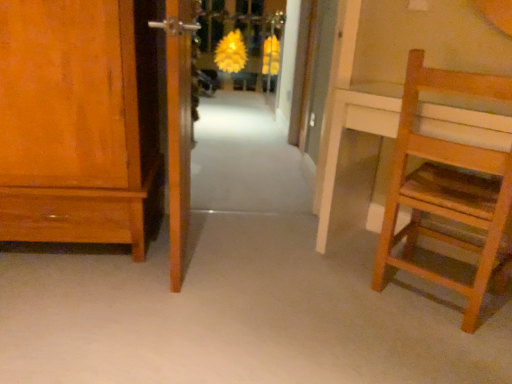
The height and width of the screenshot is (384, 512). I want to click on light brown wooden chair at right, so click(448, 188).

This screenshot has width=512, height=384. Describe the element at coordinates (318, 76) in the screenshot. I see `wooden door at center, positioned as the second door in front-to-back order` at that location.

Describe the element at coordinates (179, 124) in the screenshot. I see `wooden door at left, which ranks as the second door in back-to-front order` at that location.

Image resolution: width=512 pixels, height=384 pixels. What do you see at coordinates (239, 315) in the screenshot?
I see `wooden floor at center` at bounding box center [239, 315].

The height and width of the screenshot is (384, 512). Identify the location of yellow matte flower at center. (231, 52).

Does point (315, 124) lie in front of point (413, 128)?

No, it is behind (413, 128).

Is wooden door at center, positioned as the second door in front-to-back order, not close to light brown wooden chair at right?

Yes.

Choose the correct answer: Is wooden door at center, which ranks as the second door in left-to-right order, inside light brown wooden chair at right or outside it?

The correct answer is: outside.

At what (x,y) coordinates should I click in order to perform the action: click on chair below the wooden door at center, acting as the first door starting from the back (from the image's perspective). Please return your answer as a coordinate pair (x, y). Looking at the image, I should click on (448, 188).

Find the location of a particular element. This screenshot has height=384, width=512. plain located in front of the wooden door at left, which is the 2th door in right-to-left order is located at coordinates (239, 315).

Looking at their sizes, would you say wooden floor at center is wider or thinner than wooden door at left, acting as the first door starting from the front?

Considering their sizes, wooden floor at center looks broader than wooden door at left, acting as the first door starting from the front.

From the image's perspective, is wooden floor at center positioned above or below wooden door at left, which appears as the 1th door when viewed from the left?

Clearly, from the image's perspective, wooden floor at center is below wooden door at left, which appears as the 1th door when viewed from the left.

Would you say matte wood cabinet at left is outside wooden floor at center?

Yes, matte wood cabinet at left is located beyond the bounds of wooden floor at center.

From the image's perspective, between matte wood cabinet at left and wooden floor at center, which one is located above?

matte wood cabinet at left.

From a real-world perspective, between matte wood cabinet at left and wooden floor at center, who is vertically lower?

wooden floor at center is physically lower.

Does point (108, 224) appear closer or farther from the camera than point (414, 383)?

Point (108, 224) is positioned farther from the camera compared to point (414, 383).

Identify the location of plain located underneath the wooden door at center, positioned as the second door in front-to-back order (from a real-world perspective). (239, 315).

Who is bigger, wooden floor at center or wooden door at center, which ranks as the second door in left-to-right order?

wooden floor at center.

Does wooden floor at center touch wooden door at center, acting as the first door starting from the back?

No, wooden floor at center is not next to wooden door at center, acting as the first door starting from the back.

Is wooden floor at center taller or shorter than wooden door at center, which ranks as the second door in left-to-right order?

In the image, wooden floor at center appears to be shorter than wooden door at center, which ranks as the second door in left-to-right order.

From the picture: Considering the relative sizes of wooden floor at center and white carpet at center in the image provided, is wooden floor at center bigger than white carpet at center?

No, wooden floor at center is not bigger than white carpet at center.

Is wooden floor at center in front of or behind white carpet at center in the image?

Visually, wooden floor at center is located in front of white carpet at center.

Can you confirm if wooden floor at center is taller than white carpet at center?

In fact, wooden floor at center may be shorter than white carpet at center.

Is wooden floor at center facing towards white carpet at center?

Yes, wooden floor at center faces towards white carpet at center.

Between wooden floor at center and matte wood cabinet at left, which one appears on the left side from the viewer's perspective?

matte wood cabinet at left is more to the left.

Is there a large distance between wooden floor at center and matte wood cabinet at left?

That's not correct — wooden floor at center is a little close to matte wood cabinet at left.

In the scene shown: From a real-world perspective, is wooden floor at center on top of matte wood cabinet at left?

No, from a real-world perspective, wooden floor at center is not over matte wood cabinet at left

Is wooden floor at center located outside matte wood cabinet at left?

wooden floor at center is positioned outside matte wood cabinet at left.

Between point (208, 336) and point (227, 63), which one is positioned behind?

The point (227, 63) is farther from the camera.

Is wooden floor at center beside yellow matte flower at center?

No, wooden floor at center is not with yellow matte flower at center.

From a real-world perspective, which object stands above the other?

In real-world perspective, yellow matte flower at center is above.

I want to click on chair below the wooden door at center, the 1th door positioned from the right (from the image's perspective), so click(x=448, y=188).

I want to click on the 1st door behind the wooden floor at center, counting from the anchor's position, so click(179, 124).

From the picture: Considering their positions, is wooden door at left, which ranks as the second door in back-to-front order, positioned closer to wooden door at center, acting as the first door starting from the back, than matte wood cabinet at left?

wooden door at left, which ranks as the second door in back-to-front order, lies closer to wooden door at center, acting as the first door starting from the back, than the other object.

Estimate the real-world distances between objects in this image. Which object is further from white carpet at center, matte wood cabinet at left or wooden door at center, positioned as the second door in front-to-back order?

matte wood cabinet at left is further to white carpet at center.

Which object lies further to the anchor point matte wood cabinet at left, light brown wooden chair at right or yellow matte flower at center?

yellow matte flower at center is further to matte wood cabinet at left.

Based on their spatial positions, is wooden door at center, acting as the first door starting from the back, or wooden floor at center further from matte wood cabinet at left?

Based on the image, wooden door at center, acting as the first door starting from the back, appears to be further to matte wood cabinet at left.

From the image, which object appears to be nearer to yellow matte flower at center, wooden floor at center or matte wood cabinet at left?

matte wood cabinet at left lies closer to yellow matte flower at center than the other object.

Which object lies further to the anchor point light brown wooden chair at right, yellow matte flower at center or matte wood cabinet at left?

yellow matte flower at center lies further to light brown wooden chair at right than the other object.

From the image, which object appears to be farther from wooden floor at center, white carpet at center or wooden door at left, acting as the first door starting from the front?

white carpet at center.

Looking at the image, which one is located further to wooden door at left, which is the 2th door in right-to-left order, wooden floor at center or light brown wooden chair at right?

light brown wooden chair at right is further to wooden door at left, which is the 2th door in right-to-left order.

I want to click on door between matte wood cabinet at left and wooden floor at center in the horizontal direction, so click(x=179, y=124).

Find the location of `plain between wooden door at left, which is the 2th door in right-to-left order, and light brown wooden chair at right from left to right`. plain between wooden door at left, which is the 2th door in right-to-left order, and light brown wooden chair at right from left to right is located at coordinates (239, 315).

The image size is (512, 384). I want to click on plain situated between matte wood cabinet at left and light brown wooden chair at right from left to right, so click(x=239, y=315).

At what (x,y) coordinates should I click in order to perform the action: click on cabinetry between wooden floor at center and wooden door at center, positioned as the second door in front-to-back order, in the front-back direction. Please return your answer as a coordinate pair (x, y). This screenshot has height=384, width=512. Looking at the image, I should click on (77, 121).